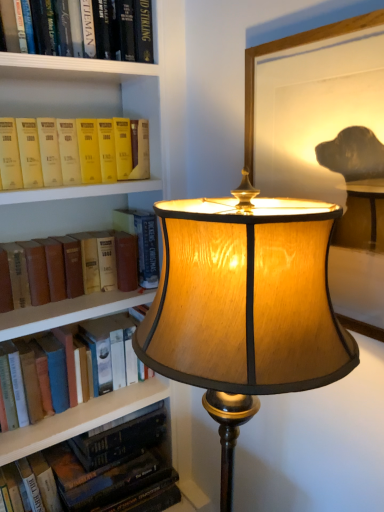
Question: Is matte yellow book at left, placed as the first book when sorted from top to bottom, positioned behind hardcover book at lower left, which is the fifth book from top to bottom?

Choices:
 (A) yes
 (B) no

Answer: (B)

Question: Can you confirm if matte yellow book at left, the 5th book from the bottom, is bigger than hardcover book at lower left, which is the fifth book from top to bottom?

Choices:
 (A) no
 (B) yes

Answer: (A)

Question: Considering the relative sizes of matte yellow book at left, placed as the first book when sorted from top to bottom, and hardcover book at lower left, positioned as the 1th book in bottom-to-top order, in the image provided, is matte yellow book at left, placed as the first book when sorted from top to bottom, shorter than hardcover book at lower left, positioned as the 1th book in bottom-to-top order,?

Choices:
 (A) yes
 (B) no

Answer: (A)

Question: Could hardcover book at lower left, positioned as the 1th book in bottom-to-top order, be considered to be inside matte yellow book at left, placed as the first book when sorted from top to bottom?

Choices:
 (A) yes
 (B) no

Answer: (B)

Question: Considering the relative sizes of matte yellow book at left, placed as the first book when sorted from top to bottom, and hardcover book at lower left, which is the fifth book from top to bottom, in the image provided, is matte yellow book at left, placed as the first book when sorted from top to bottom, thinner than hardcover book at lower left, which is the fifth book from top to bottom,?

Choices:
 (A) no
 (B) yes

Answer: (B)

Question: From a real-world perspective, is hardcover book at lower left, positioned as the 1th book in bottom-to-top order, positioned above or below matte yellow book at left, the 5th book from the bottom?

Choices:
 (A) above
 (B) below

Answer: (B)

Question: Is point (67, 450) closer or farther from the camera than point (96, 143)?

Choices:
 (A) closer
 (B) farther

Answer: (B)

Question: Considering the positions of hardcover book at lower left, which is the fifth book from top to bottom, and matte yellow book at left, the 5th book from the bottom, in the image, is hardcover book at lower left, which is the fifth book from top to bottom, wider or thinner than matte yellow book at left, the 5th book from the bottom,?

Choices:
 (A) thin
 (B) wide

Answer: (B)

Question: In terms of size, does hardcover book at lower left, which is the fifth book from top to bottom, appear bigger or smaller than matte yellow book at left, placed as the first book when sorted from top to bottom?

Choices:
 (A) big
 (B) small

Answer: (A)

Question: In terms of height, does brown leather book at left, which is counted as the 3th book, starting from the bottom, look taller or shorter compared to wooden lampshade at center?

Choices:
 (A) tall
 (B) short

Answer: (B)

Question: From the image's perspective, is brown leather book at left, which is counted as the 3th book, starting from the top, located above or below wooden lampshade at center?

Choices:
 (A) above
 (B) below

Answer: (A)

Question: Considering the positions of point (117, 268) and point (297, 330), is point (117, 268) closer or farther from the camera than point (297, 330)?

Choices:
 (A) closer
 (B) farther

Answer: (B)

Question: Is brown leather book at left, which is counted as the 3th book, starting from the bottom, in front of or behind wooden lampshade at center in the image?

Choices:
 (A) behind
 (B) front

Answer: (A)

Question: Is hardcover book at center, the 4th book in the bottom-to-top sequence, inside or outside of wooden lampshade at center?

Choices:
 (A) outside
 (B) inside

Answer: (A)

Question: From the image's perspective, relative to wooden lampshade at center, is hardcover book at center, the 2th book in the top-to-bottom sequence, above or below?

Choices:
 (A) below
 (B) above

Answer: (B)